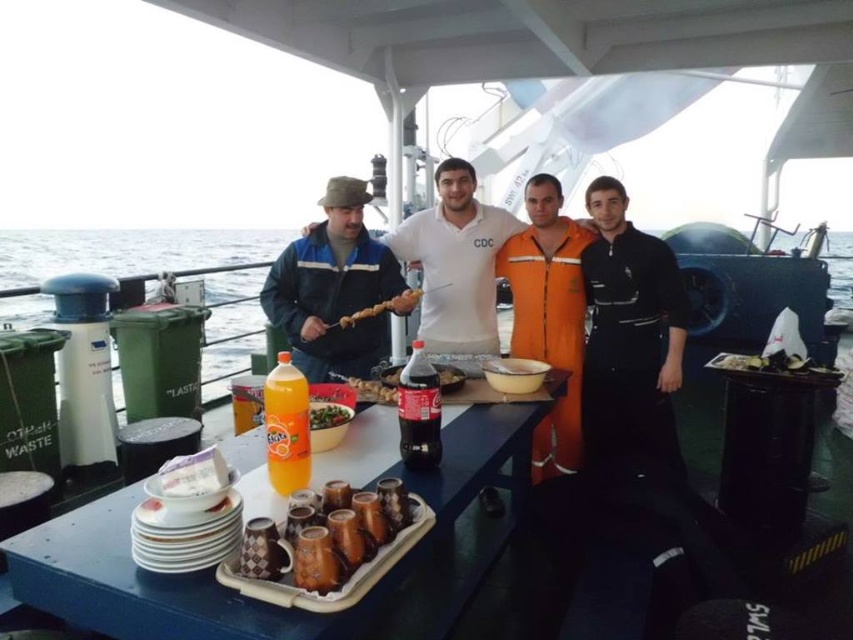
Question: From the image, what is the correct spatial relationship of shiny plastic skewer at center in relation to smooth plastic bottle at center?

Choices:
 (A) below
 (B) above

Answer: (A)

Question: Can you confirm if blue plastic table at center is positioned to the right of brown wooden skewer at center?

Choices:
 (A) yes
 (B) no

Answer: (A)

Question: Which object appears closest to the camera in this image?

Choices:
 (A) brown ceramic mug at center
 (B) translucent plastic bottle at center
 (C) white matte bowl at center
 (D) green leafy vegetables at center

Answer: (A)

Question: Which object is closer to the camera taking this photo?

Choices:
 (A) green leafy vegetables at center
 (B) translucent plastic bottle at center
 (C) brown ceramic mug at center

Answer: (C)

Question: Which object is the farthest from the shiny plastic skewer at center?

Choices:
 (A) blue plastic table at center
 (B) shiny silver tray at right
 (C) black matte jacket at right

Answer: (B)

Question: Is brown ceramic mug at center smaller than smooth plastic bottle at center?

Choices:
 (A) no
 (B) yes

Answer: (A)